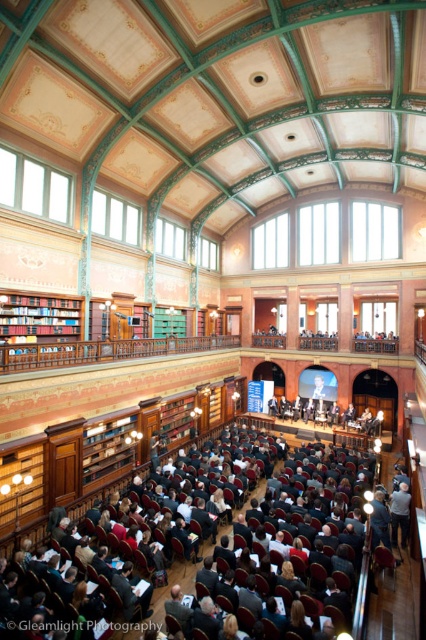
You are standing at the entrance of the auditorium and see the dark gray suit at center located at point (181, 566). If you want to walk directly towards it, which direction should you head?

You should head towards the center of the auditorium to reach the dark gray suit at center located at point (181, 566).

You are sitting in the auditorium and want to hand a note to the person in the dark gray suit at center. There is also a wooden bookshelf at left nearby. Which object is closer to you?

The dark gray suit at center is closer to the viewer than the wooden bookshelf at left, so you should target the dark gray suit at center first as it is nearer.